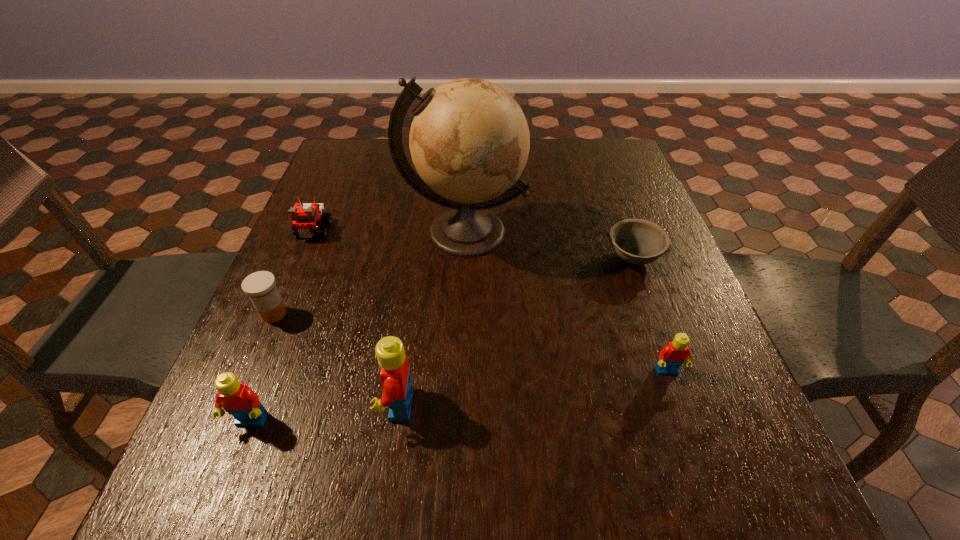
Where is `vacant space located on the face of the second Lego from right to left`? Image resolution: width=960 pixels, height=540 pixels. vacant space located on the face of the second Lego from right to left is located at coordinates (351, 404).

Find the location of a particular element. The width and height of the screenshot is (960, 540). vacant area situated on the face of the rightmost Lego is located at coordinates (686, 428).

The height and width of the screenshot is (540, 960). Identify the location of free spot located 0.070m on the back of the bowl. (619, 221).

Find the location of a particular element. free spot located 0.260m on the front-facing side of the farthest Lego is located at coordinates (272, 329).

You are a GUI agent. You are given a task and a screenshot of the screen. Output one action in this format:
    pyautogui.click(x=<x>, y=<y>)
    Task: Click on the free space located on the front-facing side of the globe
    
    Given the screenshot: What is the action you would take?
    pyautogui.click(x=460, y=348)

Where is `vacant space situated on the label of the fourth nearest object`? The image size is (960, 540). vacant space situated on the label of the fourth nearest object is located at coordinates (402, 314).

Locate an element on the screen. The height and width of the screenshot is (540, 960). medicine that is at the left edge is located at coordinates (260, 286).

At what (x,y) coordinates should I click in order to perform the action: click on Lego that is at the right edge. Please return your answer as a coordinate pair (x, y). The width and height of the screenshot is (960, 540). Looking at the image, I should click on (671, 357).

The height and width of the screenshot is (540, 960). Identify the location of bowl at the right edge. (636, 241).

Where is `object that is at the near left corner`? The width and height of the screenshot is (960, 540). object that is at the near left corner is located at coordinates (237, 399).